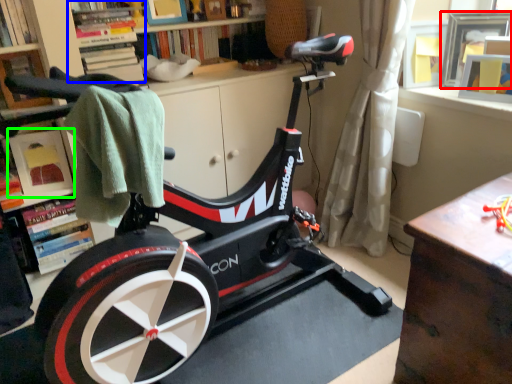
Question: Which is nearer to the picture frame (highlighted by a red box)? shelf (highlighted by a blue box) or shelf (highlighted by a green box).

Choices:
 (A) shelf
 (B) shelf

Answer: (A)